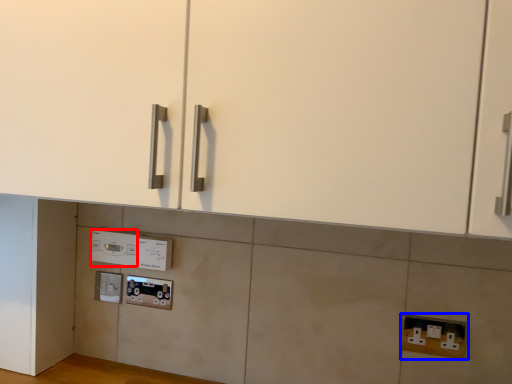
Question: Which object appears closest to the camera in this image, appliance (highlighted by a red box) or electric outlet (highlighted by a blue box)?

Choices:
 (A) appliance
 (B) electric outlet

Answer: (B)